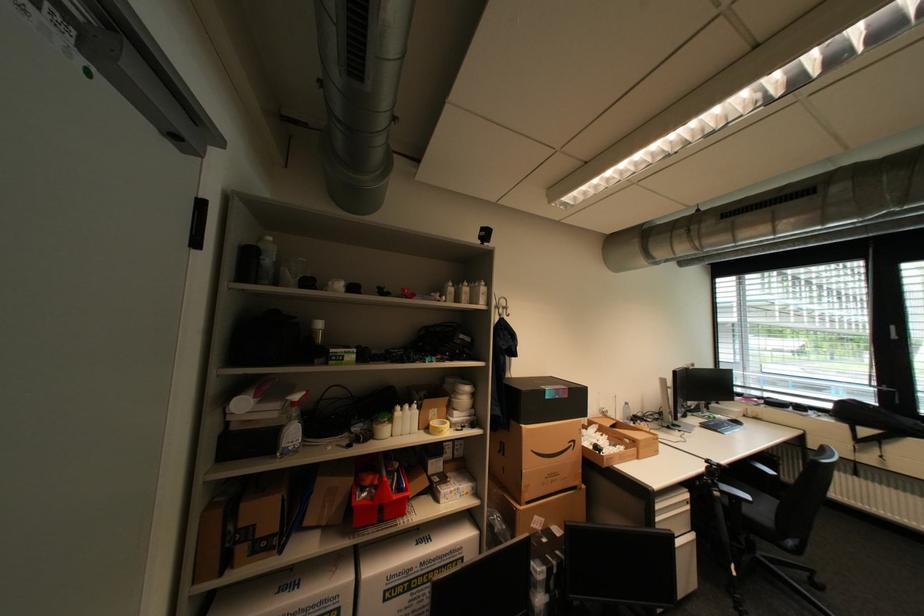
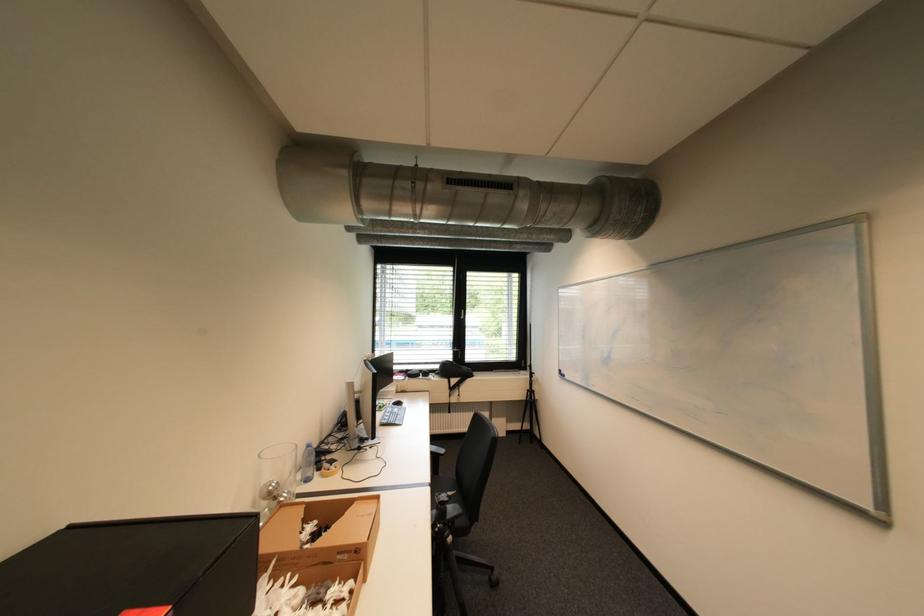
Find the pixel in the second image that matches pixel 837 406 in the first image.

(445, 368)